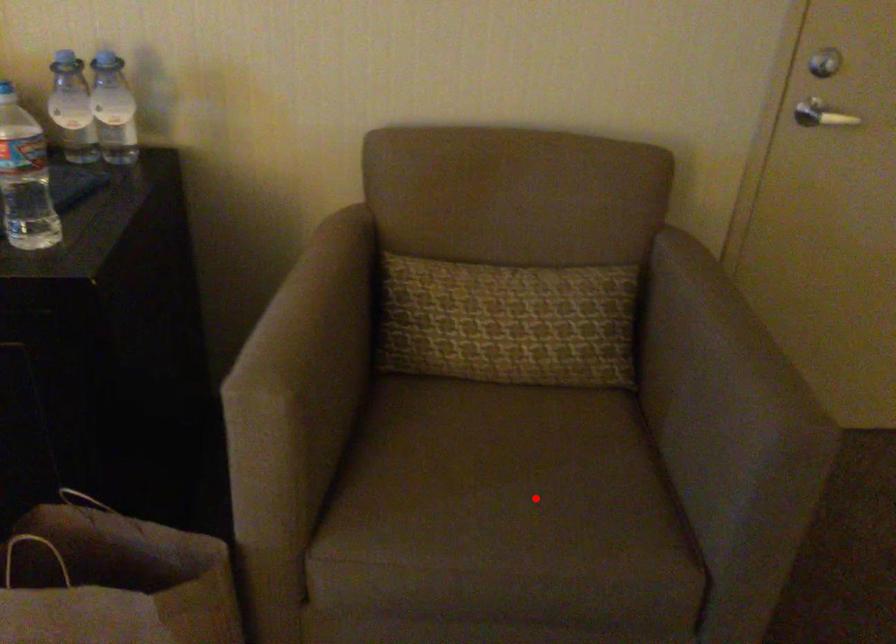
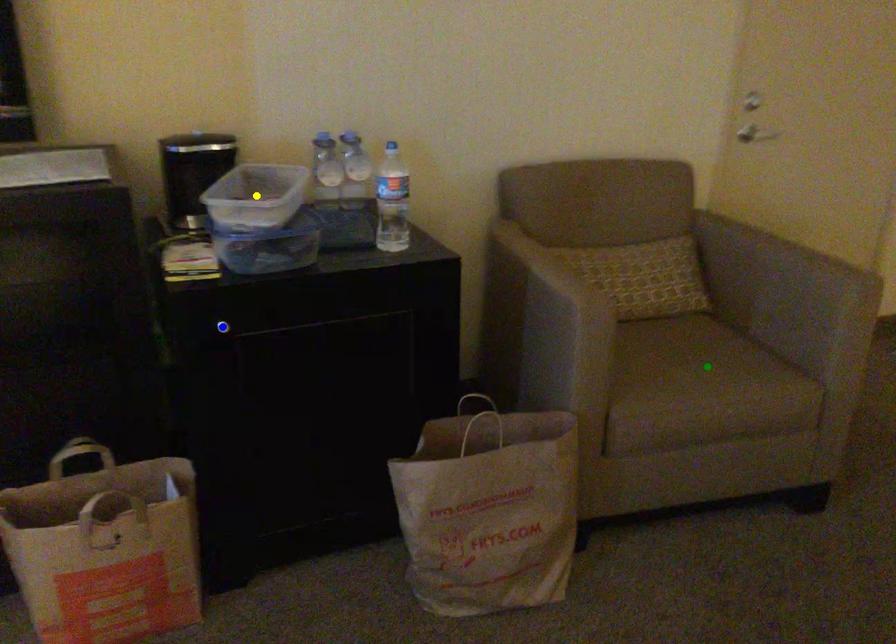
Question: I am providing you with two images of the same scene from different viewpoints. A red point is marked on the first image. You are given multiple points on the second image. In image 2, which mark is for the same physical point as the one in image 1?

Choices:
 (A) blue point
 (B) green point
 (C) yellow point

Answer: (B)